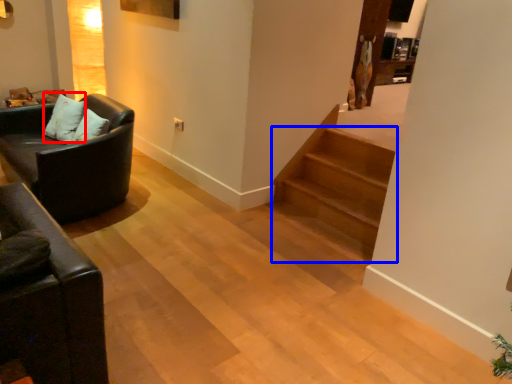
Question: Which object is closer to the camera taking this photo, pillow (highlighted by a red box) or stairs (highlighted by a blue box)?

Choices:
 (A) pillow
 (B) stairs

Answer: (B)